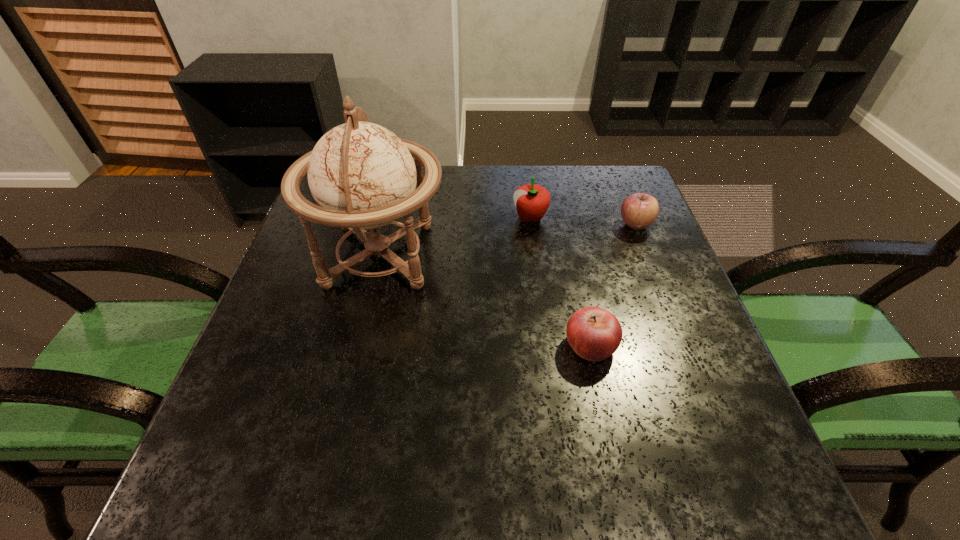
What are the coordinates of `unoccupied area between the nearest apple and the leftmost object` in the screenshot? It's located at (485, 301).

Locate an element on the screen. blank region between the globe and the rightmost object is located at coordinates (508, 240).

The image size is (960, 540). Identify the location of the second closest object to the rightmost object. (594, 334).

You are a GUI agent. You are given a task and a screenshot of the screen. Output one action in this format:
    pyautogui.click(x=<x>, y=<y>)
    Task: Click on the object that is the third closest one to the rightmost object
    This screenshot has height=540, width=960.
    Given the screenshot: What is the action you would take?
    tap(362, 176)

Identify the location of apple identified as the closest to the rightmost apple. This screenshot has height=540, width=960. (532, 201).

Select which apple appears as the second closest to the rightmost object. Please provide its 2D coordinates. Your answer should be formatted as a tuple, i.e. [(x, y)], where the tuple contains the x and y coordinates of a point satisfying the conditions above.

[(594, 334)]

The height and width of the screenshot is (540, 960). What are the coordinates of `free space that satisfies the following two spatial constraints: 1. on the front-facing side of the globe; 2. on the left side of the nearest object` in the screenshot? It's located at (358, 346).

Where is `free space that satisfies the following two spatial constraints: 1. on the front-facing side of the tallest object; 2. on the back side of the nearest apple`? The height and width of the screenshot is (540, 960). free space that satisfies the following two spatial constraints: 1. on the front-facing side of the tallest object; 2. on the back side of the nearest apple is located at coordinates (358, 346).

Locate an element on the screen. free space that satisfies the following two spatial constraints: 1. on the front-facing side of the globe; 2. on the left side of the nearest apple is located at coordinates (358, 346).

Locate an element on the screen. free space that satisfies the following two spatial constraints: 1. on the front-facing side of the leftmost object; 2. on the back side of the nearest apple is located at coordinates (358, 346).